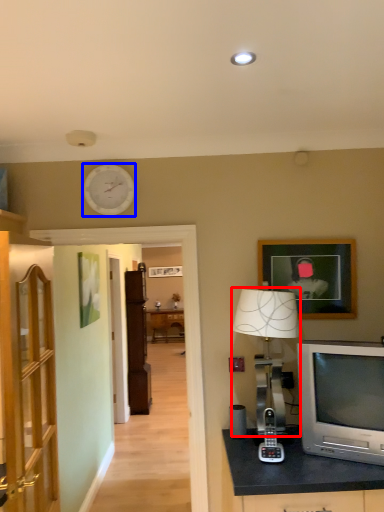
Question: Which of the following is the farthest to the observer, table lamp (highlighted by a red box) or clock (highlighted by a blue box)?

Choices:
 (A) table lamp
 (B) clock

Answer: (B)